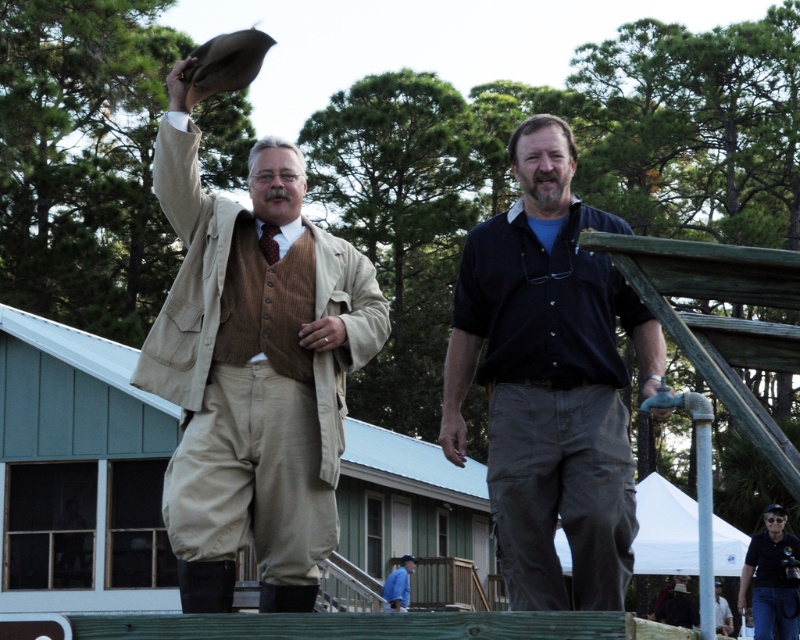
You are a photographer trying to capture a group photo of the beige wool suit at center and the dark blue shirt at center. Since you want to frame them symmetrically, which one should be placed to the left to maintain symmetry?

The beige wool suit at center should be placed to the left to maintain symmetry because it is already positioned on the left side of the dark blue shirt at center in the original image.

You are a photographer standing 10 feet away from the two men. You want to take a picture that includes both the dark brown leather jacket at center and the light blue shirt at center. Is there enough space between them for both to fit in the frame if your camera has a 5 feet wide field of view?

The dark brown leather jacket at center and light blue shirt at center are 6.67 feet apart from each other. Since the distance between them exceeds the camera field of view of 5 feet, they cannot both fit in the frame at the same time.